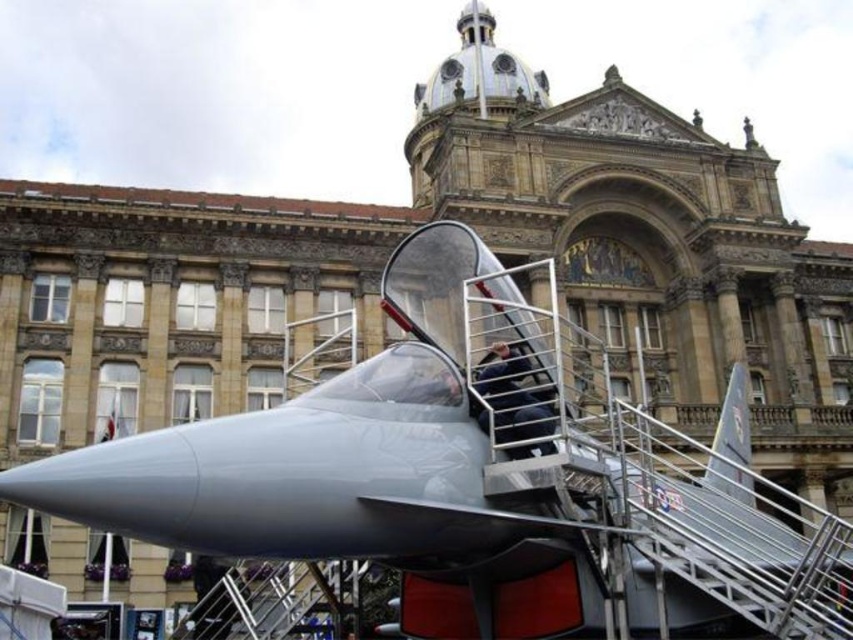
Is metallic gray jet at center wider than stainless steel staircase at center?

Correct, the width of metallic gray jet at center exceeds that of stainless steel staircase at center.

Is metallic gray jet at center shorter than stainless steel staircase at center?

In fact, metallic gray jet at center may be taller than stainless steel staircase at center.

Is point (463, 230) behind point (231, 577)?

No, it is in front of (231, 577).

Where is `metallic gray jet at center`? The image size is (853, 640). metallic gray jet at center is located at coordinates (479, 477).